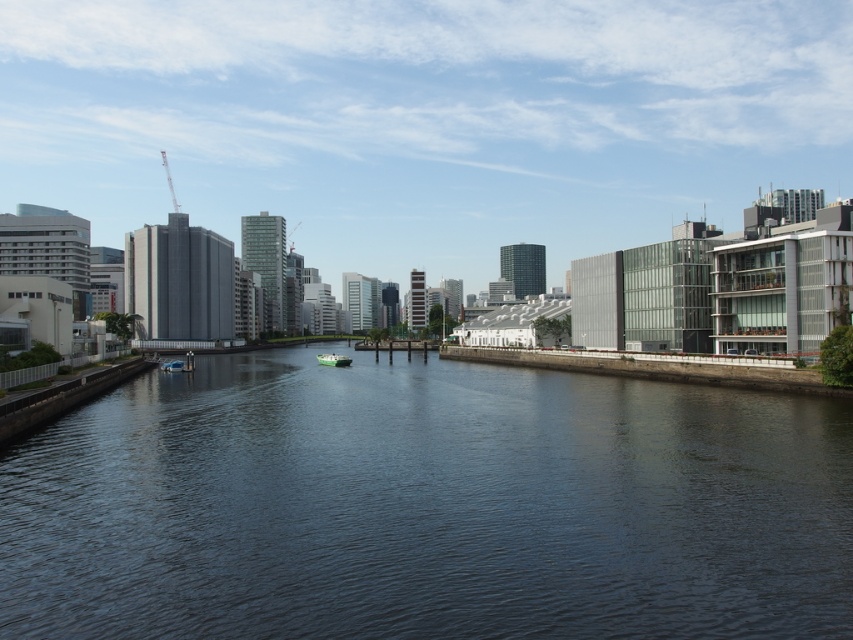
Looking at this image, you are an architect designing a new floating structure that needs to be taller than the blue glossy boat at center. Based on the scene, can the structure be placed in the dark blue water at center without exceeding the height restrictions imposed by local regulations?

The dark blue water at center has a greater height compared to the blue glossy boat at center. Therefore, the floating structure can be designed to be taller than the blue glossy boat at center and placed in the dark blue water at center without violating height restrictions, as the water itself allows for greater height.

You are a tour guide leading a group on the right bank of the river. You want to show them the blue glossy boat at center. Which direction should you point to so they can see it from the dark blue water at center?

The blue glossy boat at center is located at the center of the dark blue water at center, so you should point towards the center of the dark blue water at center to show them the boat.